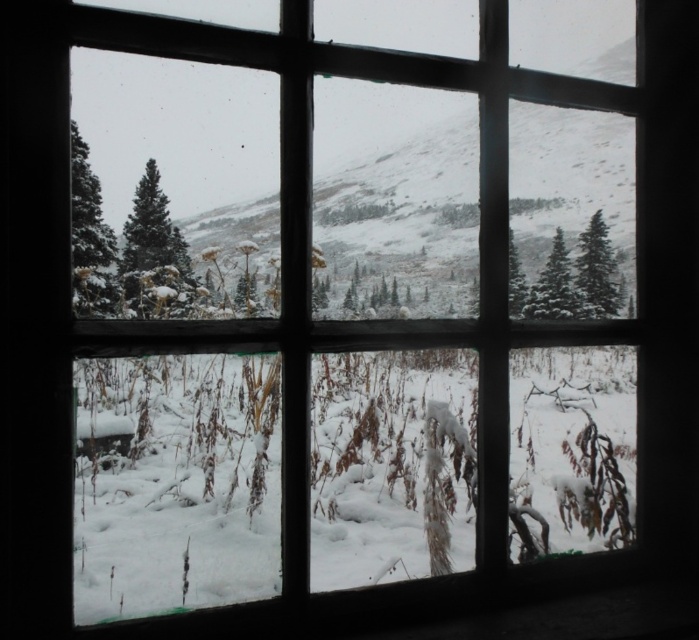
Between point (101, 285) and point (145, 202), which one is positioned behind?

The point (101, 285) is behind.

Between green matte tree at left and green matte tree at center, which one appears on the right side from the viewer's perspective?

From the viewer's perspective, green matte tree at center appears more on the right side.

Is point (110, 243) positioned after point (175, 241)?

Yes, it is behind point (175, 241).

At what (x,y) coordinates should I click in order to perform the action: click on green matte tree at left. Please return your answer as a coordinate pair (x, y). Looking at the image, I should click on (89, 237).

Is green matte tree at left to the right of green matte tree at right from the viewer's perspective?

No, green matte tree at left is not to the right of green matte tree at right.

Image resolution: width=699 pixels, height=640 pixels. Describe the element at coordinates (89, 237) in the screenshot. I see `green matte tree at left` at that location.

Locate an element on the screen. This screenshot has width=699, height=640. green matte tree at left is located at coordinates (89, 237).

Can you confirm if green matte tree at right is positioned above green matte tree at center-right?

Yes.

This screenshot has width=699, height=640. In order to click on green matte tree at right in this screenshot , I will do `click(598, 273)`.

Is point (600, 234) positioned before point (563, 310)?

Yes.

This screenshot has width=699, height=640. Find the location of `green matte tree at right`. green matte tree at right is located at coordinates (598, 273).